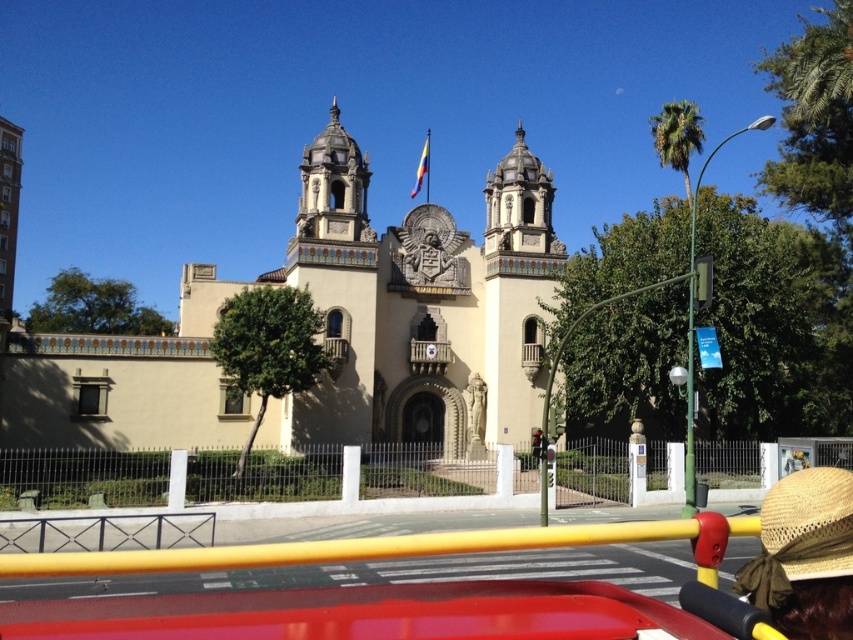
Question: Can you confirm if beige stone church at center is thinner than straw at center?

Choices:
 (A) yes
 (B) no

Answer: (B)

Question: Does beige stone church at center have a larger size compared to straw at center?

Choices:
 (A) yes
 (B) no

Answer: (A)

Question: Which of the following is the farthest from the observer?

Choices:
 (A) (447, 381)
 (B) (808, 474)

Answer: (A)

Question: Does beige stone church at center appear over straw at center?

Choices:
 (A) yes
 (B) no

Answer: (A)

Question: Among these objects, which one is nearest to the camera?

Choices:
 (A) straw at center
 (B) beige stone church at center

Answer: (A)